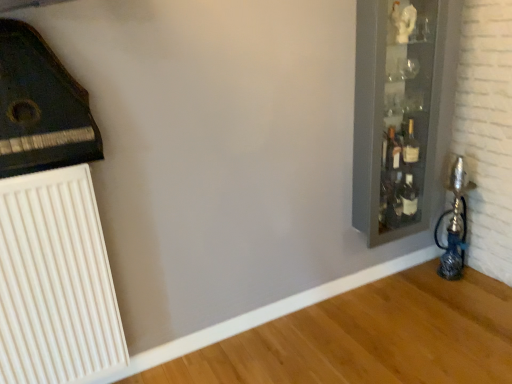
What are the coordinates of `free spot above white plastic radiator at lower left (from a real-world perspective)` in the screenshot? It's located at (37, 171).